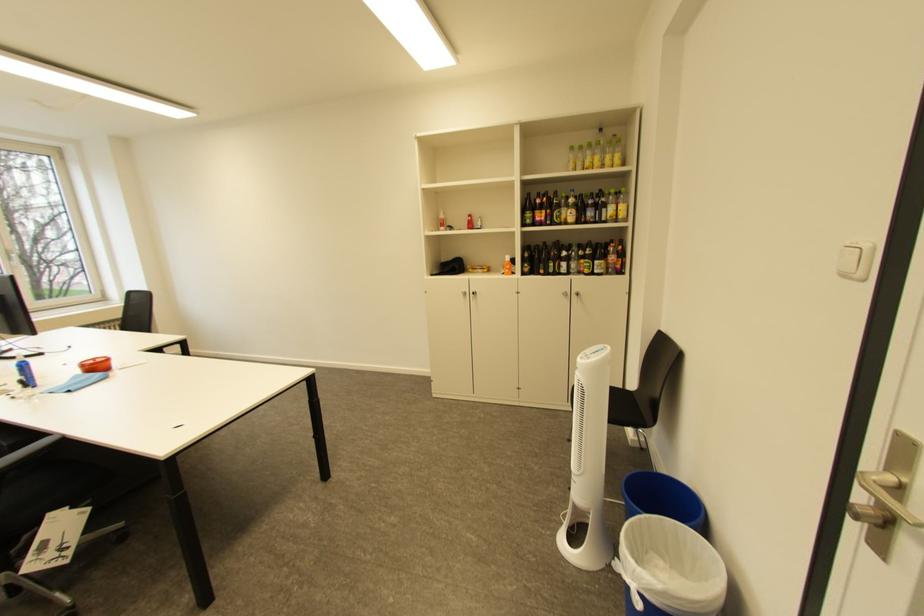
Find where to lift the orange container lid. Please return your answer as a coordinate pair (x, y).

(94, 363)